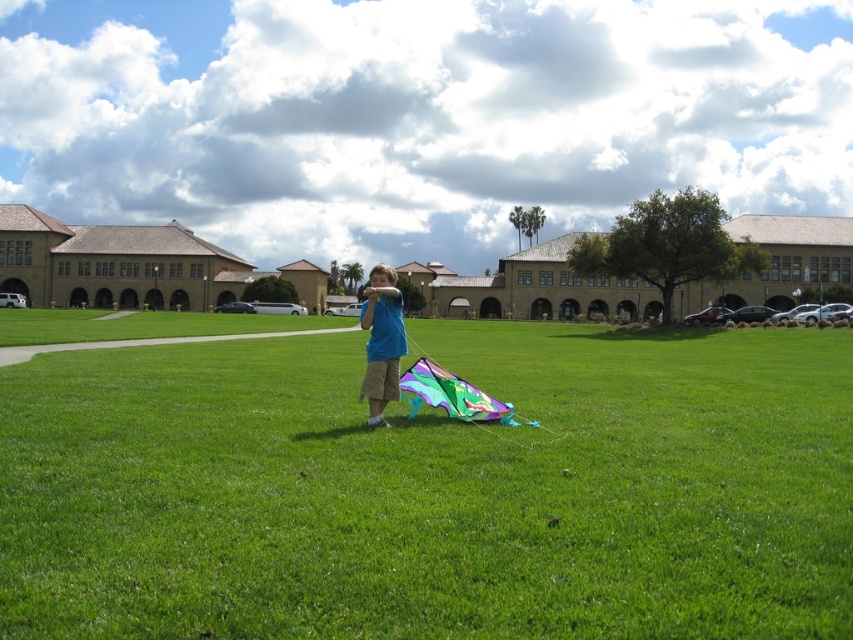
In the image of the grassy field, where is the multicolored kite at center located in terms of coordinates?

The multicolored kite at center is located at point coordinates of (x=433, y=490).

You are a photographer trying to capture the boy and his kite. Since the blue cotton shirt at center and the multicolored fabric kite at center are both in the frame, can you tell which one is higher in the photo?

The blue cotton shirt at center is above the multicolored fabric kite at center in the photo.